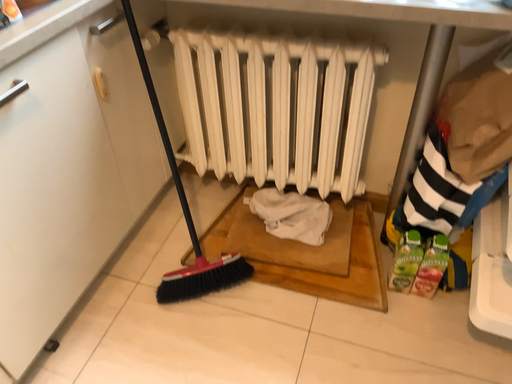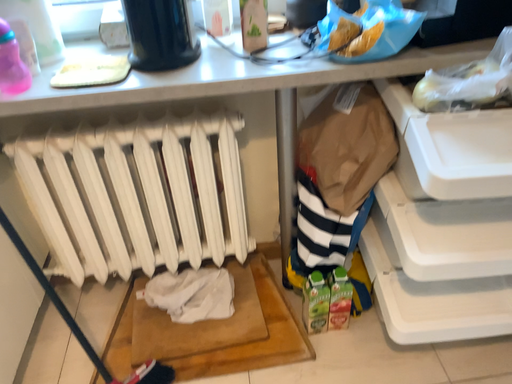
Question: How did the camera likely rotate when shooting the video?

Choices:
 (A) rotated right
 (B) rotated left

Answer: (A)